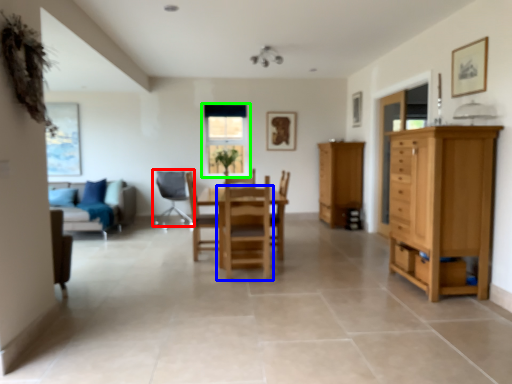
Question: Which is farther away from chair (highlighted by a red box)? chair (highlighted by a blue box) or window (highlighted by a green box)?

Choices:
 (A) chair
 (B) window

Answer: (A)